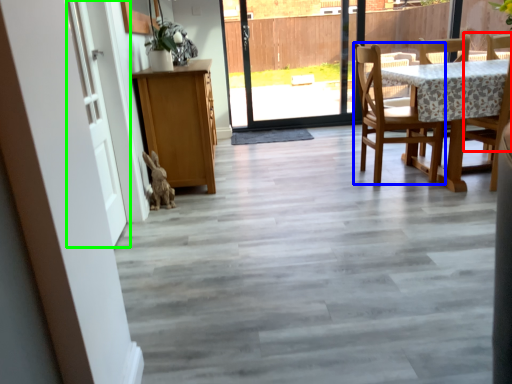
Question: Which is nearer to the chair (highlighted by a red box)? chair (highlighted by a blue box) or door (highlighted by a green box).

Choices:
 (A) chair
 (B) door

Answer: (A)